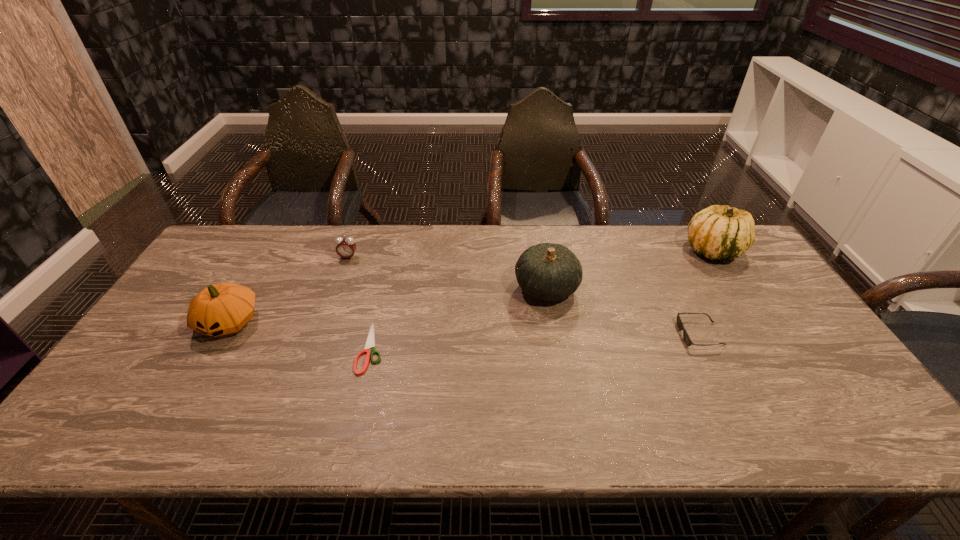
This screenshot has height=540, width=960. Find the location of `vacant space that satisfies the following two spatial constraints: 1. on the back side of the third object from right to left; 2. on the left side of the rightmost object`. vacant space that satisfies the following two spatial constraints: 1. on the back side of the third object from right to left; 2. on the left side of the rightmost object is located at coordinates (540, 249).

I want to click on vacant region that satisfies the following two spatial constraints: 1. on the clock face of the fourth object from left to right; 2. on the right side of the alarm clock, so click(x=337, y=288).

You are a GUI agent. You are given a task and a screenshot of the screen. Output one action in this format:
    pyautogui.click(x=<x>, y=<y>)
    Task: Click on the free space that satisfies the following two spatial constraints: 1. on the back side of the scissors; 2. on the left side of the rightmost gourd
    The width and height of the screenshot is (960, 540).
    Given the screenshot: What is the action you would take?
    pyautogui.click(x=395, y=249)